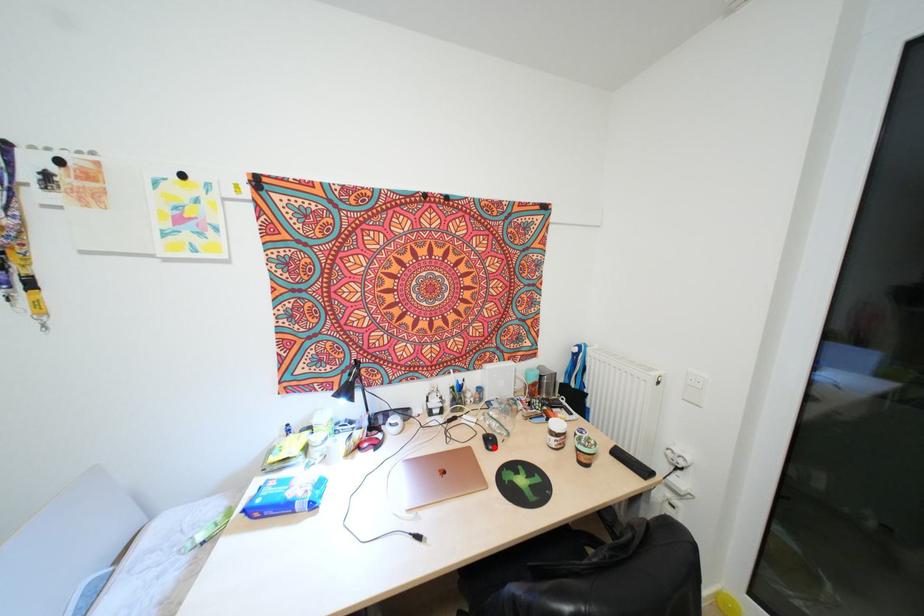
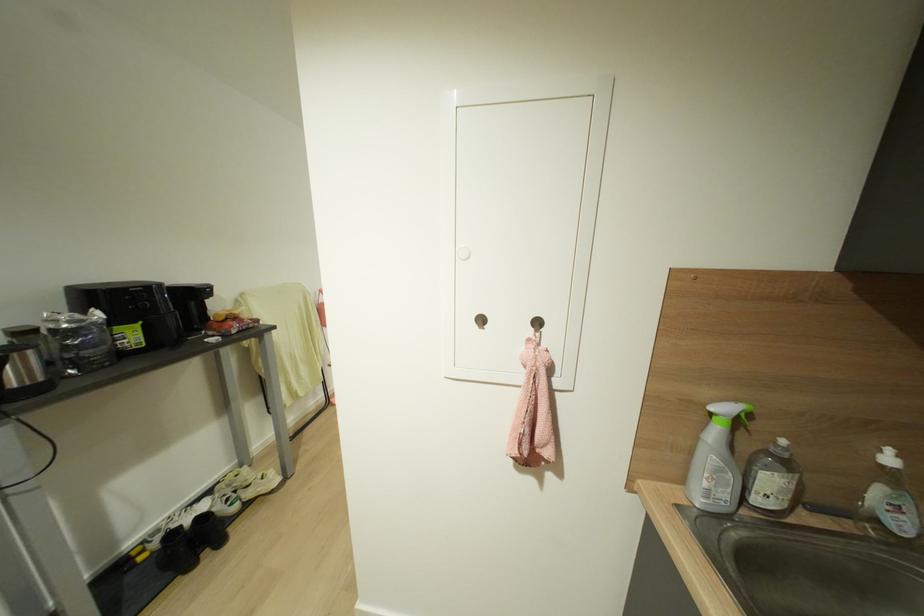
Question: I am providing you with two images of the same scene from different viewpoints. A red point is marked on the first image. At the location where the point appears in image 1, is it still visible in image 2?

Choices:
 (A) Yes
 (B) No

Answer: (B)